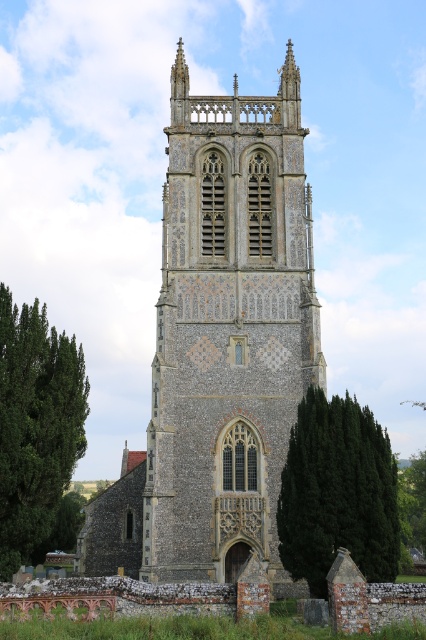
You are a photographer standing at the base of the stone tower at center, wanting to capture a clear photo of the tower without any obstructions. However, there is a dark green coniferous tree at lower right in the scene. Which object is closer to you so that you can adjust your position accordingly?

The stone tower at center is closer to you than the dark green coniferous tree at lower right, so you can move around the tower to avoid the tree obstructing your view.

You are standing in front of the historic stone church tower and want to take a photo that includes both the dark green coniferous tree at lower right and the green leafy tree at left. Which tree should you position closer to the camera to ensure both are in the frame?

You should position the dark green coniferous tree at lower right closer to the camera since it is already closer to the viewer than the green leafy tree at left, ensuring both are visible in the frame.

You are standing in front of the historic stone church tower and notice a green leafy tree nearby. Which object is taller between the stone tower at center and the green leafy tree at left?

The stone tower at center is taller than the green leafy tree at left according to the description provided.